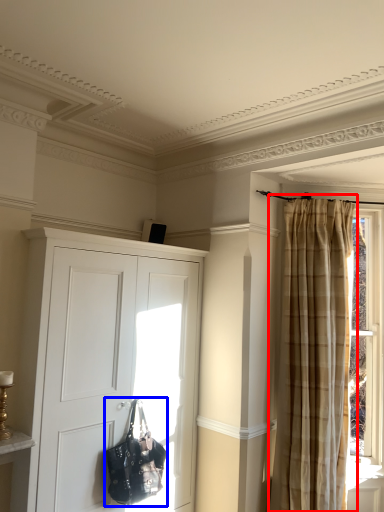
Question: Which object appears farthest to the camera in this image, curtain (highlighted by a red box) or handbag (highlighted by a blue box)?

Choices:
 (A) curtain
 (B) handbag

Answer: (A)